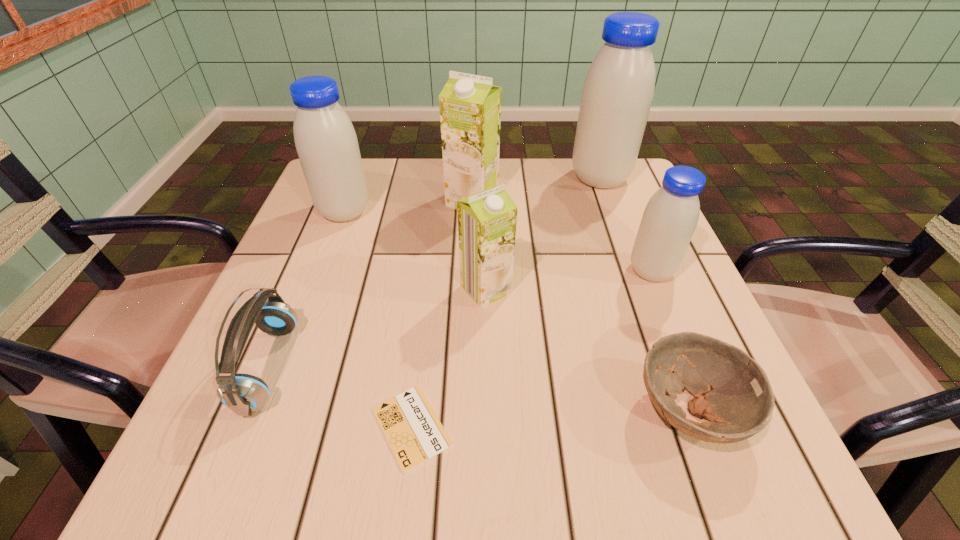
Find the location of a particular element. The image size is (960, 540). vacant space in between the bigger green soya milk and the brown bowl is located at coordinates (581, 306).

Image resolution: width=960 pixels, height=540 pixels. What are the coordinates of `object that is the closest to the bowl` in the screenshot? It's located at (669, 220).

This screenshot has height=540, width=960. In order to click on object that is the second closest to the third shortest object in this screenshot , I will do `click(327, 146)`.

Find the location of a particular element. The width and height of the screenshot is (960, 540). soya milk that is the second closest one to the nearest blue soya milk is located at coordinates (487, 220).

Select which soya milk appears as the third closest to the bowl. Please provide its 2D coordinates. Your answer should be formatted as a tuple, i.e. [(x, y)], where the tuple contains the x and y coordinates of a point satisfying the conditions above.

[(470, 106)]

In order to click on blue soya milk that is the second closest to the smaller green soya milk in this screenshot , I will do `click(327, 146)`.

Find the location of a particular element. The height and width of the screenshot is (540, 960). blue soya milk that is the second nearest to the nearest blue soya milk is located at coordinates (327, 146).

Find the location of `free spot that satisfies the following two spatial constraints: 1. on the back side of the tallest soya milk; 2. on the left side of the farther green soya milk`. free spot that satisfies the following two spatial constraints: 1. on the back side of the tallest soya milk; 2. on the left side of the farther green soya milk is located at coordinates (472, 178).